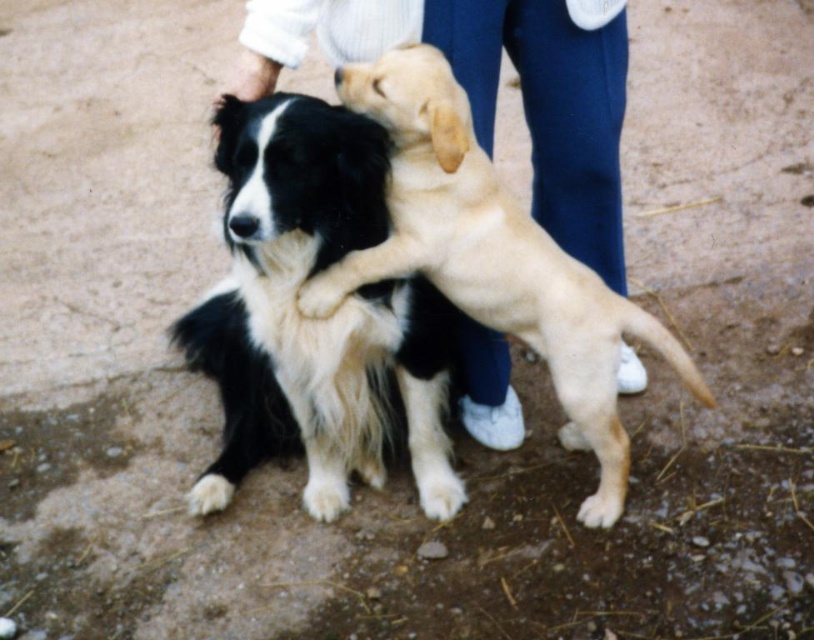
Question: Can you confirm if light brown fur at center is positioned above white fur at lower center?

Choices:
 (A) yes
 (B) no

Answer: (A)

Question: Which point is closer to the camera?

Choices:
 (A) white fur at lower center
 (B) black and white fur dog at center
 (C) white fur paw at center

Answer: (B)

Question: Does black and white fur dog at center come in front of white fur paw at center?

Choices:
 (A) yes
 (B) no

Answer: (A)

Question: Which object appears farthest from the camera in this image?

Choices:
 (A) white fur paw at center
 (B) white fur at lower center

Answer: (B)

Question: From the image, what is the correct spatial relationship of light brown fur at center in relation to white fur paw at center?

Choices:
 (A) left
 (B) right

Answer: (B)

Question: Among these objects, which one is nearest to the camera?

Choices:
 (A) black and white fur dog at center
 (B) white fur at lower center
 (C) white fur paw at center
 (D) light brown fur at center

Answer: (A)